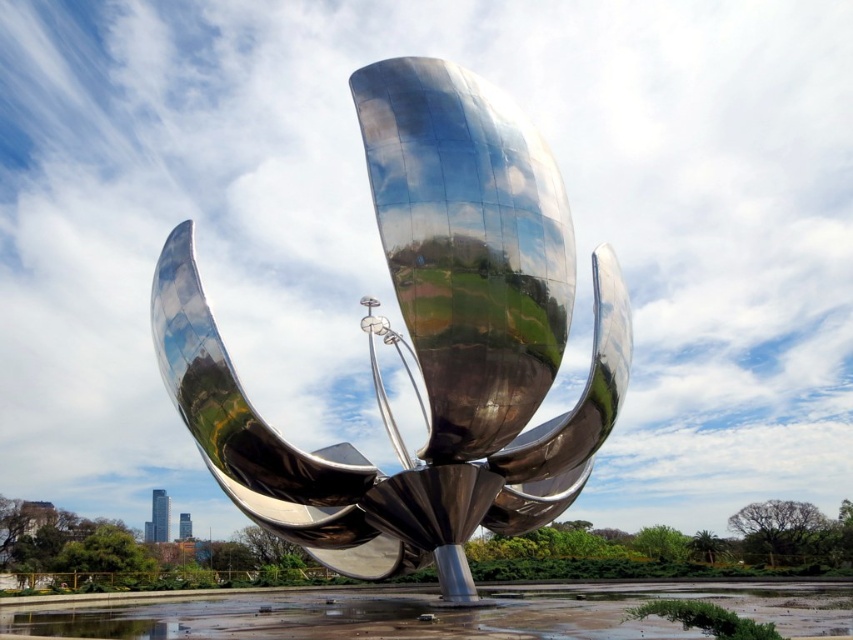
Question: Which object is farther from the camera taking this photo?

Choices:
 (A) shiny metallic sculpture at center
 (B) polished metallic flower at center

Answer: (B)

Question: Which point is closer to the camera?

Choices:
 (A) shiny metallic sculpture at center
 (B) polished metallic flower at center

Answer: (A)

Question: Is the position of polished metallic flower at center less distant than that of shiny metallic sculpture at center?

Choices:
 (A) no
 (B) yes

Answer: (A)

Question: Which point is farther to the camera?

Choices:
 (A) (395, 193)
 (B) (306, 588)

Answer: (B)

Question: Is polished metallic flower at center wider than shiny metallic sculpture at center?

Choices:
 (A) yes
 (B) no

Answer: (B)

Question: Can you confirm if polished metallic flower at center is bigger than shiny metallic sculpture at center?

Choices:
 (A) yes
 (B) no

Answer: (B)